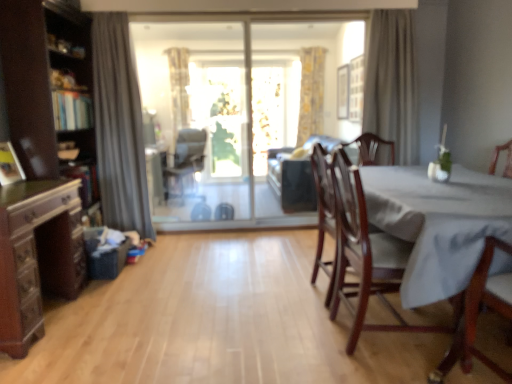
Describe the element at coordinates (37, 256) in the screenshot. The height and width of the screenshot is (384, 512). I see `dark wood dresser at left` at that location.

Where is `gray fabric curtain at left, acting as the third curtain starting from the right`? The width and height of the screenshot is (512, 384). gray fabric curtain at left, acting as the third curtain starting from the right is located at coordinates (119, 126).

Describe the element at coordinates (119, 126) in the screenshot. Image resolution: width=512 pixels, height=384 pixels. I see `gray fabric curtain at left, which is the 1th curtain in front-to-back order` at that location.

Describe the element at coordinates (324, 212) in the screenshot. I see `mahogany wood chair at right, positioned as the second chair in back-to-front order` at that location.

This screenshot has width=512, height=384. I want to click on brown wood cabinet at left, so click(39, 76).

The height and width of the screenshot is (384, 512). Describe the element at coordinates (232, 113) in the screenshot. I see `transparent glass sliding door at center, marked as the first window screen in a front-to-back arrangement` at that location.

Measure the distance between matte black chair at center, which is the first chair in left-to-right order, and camera.

The distance of matte black chair at center, which is the first chair in left-to-right order, from camera is 5.24 meters.

You are a GUI agent. You are given a task and a screenshot of the screen. Output one action in this format:
    pyautogui.click(x=<x>, y=<y>)
    Task: Click on the transparent glass screen door at center
    
    Given the screenshot: What is the action you would take?
    pyautogui.click(x=197, y=119)

Where is `dark wood dresser at left`? dark wood dresser at left is located at coordinates (37, 256).

From the image's perspective, relative to suede-like brown couch at center, is mahogany wood chair at right, which is the first chair from right to left, above or below?

mahogany wood chair at right, which is the first chair from right to left, is below suede-like brown couch at center.

Looking at this image, is mahogany wood chair at right, which is counted as the third chair, starting from the back, inside or outside of suede-like brown couch at center?

mahogany wood chair at right, which is counted as the third chair, starting from the back, cannot be found inside suede-like brown couch at center.

Is mahogany wood chair at right, marked as the 1th chair in a front-to-back arrangement, placed right next to suede-like brown couch at center?

No, mahogany wood chair at right, marked as the 1th chair in a front-to-back arrangement, is not touching suede-like brown couch at center.

Which object is more forward, mahogany wood chair at right, the 3th chair in the left-to-right sequence, or suede-like brown couch at center?

mahogany wood chair at right, the 3th chair in the left-to-right sequence.

Considering the relative sizes of matte black chair at center, which is the third chair from front to back, and transparent glass screen door at center in the image provided, is matte black chair at center, which is the third chair from front to back, taller than transparent glass screen door at center?

Incorrect, the height of matte black chair at center, which is the third chair from front to back, is not larger of that of transparent glass screen door at center.

Is matte black chair at center, which is the third chair from front to back, looking in the opposite direction of transparent glass screen door at center?

No, matte black chair at center, which is the third chair from front to back, is not facing the opposite direction of transparent glass screen door at center.

Identify the location of chair located behind the transparent glass screen door at center. This screenshot has height=384, width=512. pyautogui.click(x=185, y=159).

From a real-world perspective, which object rests below the other?

matte black chair at center, which is the third chair from front to back, is physically lower.

Could you tell me if gray fabric curtain at left, which is the first curtain in left-to-right order, is turned towards dark wood dresser at left?

Yes, gray fabric curtain at left, which is the first curtain in left-to-right order, is turned towards dark wood dresser at left.

Is gray fabric curtain at left, which is the 1th curtain in front-to-back order, directly adjacent to dark wood dresser at left?

No, gray fabric curtain at left, which is the 1th curtain in front-to-back order, is not beside dark wood dresser at left.

This screenshot has width=512, height=384. Identify the location of curtain that is the 1st object located behind the dark wood dresser at left. (119, 126).

Which of these two, gray fabric curtain at left, acting as the third curtain starting from the right, or dark wood dresser at left, is bigger?

dark wood dresser at left.

Can you confirm if mahogany wood chair at right, which is the first chair from right to left, is shorter than yellow floral fabric curtain at upper center, the 1th curtain in the back-to-front sequence?

Yes, mahogany wood chair at right, which is the first chair from right to left, is shorter than yellow floral fabric curtain at upper center, the 1th curtain in the back-to-front sequence.

From a real-world perspective, which object stands above the other?

yellow floral fabric curtain at upper center, the 1th curtain in the back-to-front sequence, from a real-world perspective.

Is mahogany wood chair at right, which is the first chair from right to left, positioned far away from yellow floral fabric curtain at upper center, the 1th curtain in the back-to-front sequence?

Yes, mahogany wood chair at right, which is the first chair from right to left, is far from yellow floral fabric curtain at upper center, the 1th curtain in the back-to-front sequence.

From the image's perspective, which one is positioned higher, dark wood dresser at left or gray fabric curtain at left, which is the 3th curtain in back-to-front order?

gray fabric curtain at left, which is the 3th curtain in back-to-front order.

Is dark wood dresser at left not within gray fabric curtain at left, which is the 1th curtain in front-to-back order?

Yes, dark wood dresser at left is located beyond the bounds of gray fabric curtain at left, which is the 1th curtain in front-to-back order.

In the scene shown: Is dark wood dresser at left smaller than gray fabric curtain at left, acting as the third curtain starting from the right?

Actually, dark wood dresser at left might be larger than gray fabric curtain at left, acting as the third curtain starting from the right.

In terms of size, does brown wood cabinet at left appear bigger or smaller than suede-like brown couch at center?

In the image, brown wood cabinet at left appears to be smaller than suede-like brown couch at center.

Which of these two, brown wood cabinet at left or suede-like brown couch at center, stands shorter?

With less height is suede-like brown couch at center.

Considering the positions of point (13, 102) and point (310, 177), is point (13, 102) closer or farther from the camera than point (310, 177)?

Point (13, 102) is closer to the camera than point (310, 177).

Does point (13, 321) appear closer or farther from the camera than point (80, 159)?

Point (13, 321).

Considering the relative sizes of dark wood dresser at left and brown wood cabinet at left in the image provided, is dark wood dresser at left wider than brown wood cabinet at left?

Yes, dark wood dresser at left is wider than brown wood cabinet at left.

From the image's perspective, which one is positioned higher, dark wood dresser at left or brown wood cabinet at left?

From the image's view, brown wood cabinet at left is above.

Between dark wood dresser at left and brown wood cabinet at left, which one has smaller size?

With smaller size is dark wood dresser at left.

From the image's perspective, starting from the suede-like brown couch at center, which chair is the 2nd one below? Please provide its 2D coordinates.

[(365, 255)]

Locate an element on the screen. The height and width of the screenshot is (384, 512). screen door on the right of the matte black chair at center, which is the first chair in left-to-right order is located at coordinates (197, 119).

When comparing their distances from gray fabric curtain at left, which is the 1th curtain in front-to-back order, does transparent glass sliding door at center, marked as the first window screen in a front-to-back arrangement, or beige fabric curtain at upper right, the 2th curtain viewed from the front, seem closer?

transparent glass sliding door at center, marked as the first window screen in a front-to-back arrangement, is closer to gray fabric curtain at left, which is the 1th curtain in front-to-back order.

Based on their spatial positions, is dark wood dresser at left or suede-like brown couch at center closer to gray fabric curtain at left, acting as the third curtain starting from the right?

dark wood dresser at left is closer to gray fabric curtain at left, acting as the third curtain starting from the right.

In the scene shown: Looking at the image, which one is located closer to dark wood dresser at left, beige fabric curtain at upper right, acting as the 2th curtain starting from the back, or mahogany wood chair at right, marked as the 1th chair in a front-to-back arrangement?

mahogany wood chair at right, marked as the 1th chair in a front-to-back arrangement, lies closer to dark wood dresser at left than the other object.

Which object lies nearer to the anchor point suede-like brown couch at center, mahogany wood chair at right, which is the first chair from right to left, or beige fabric curtain at upper right, the 2th curtain viewed from the front?

beige fabric curtain at upper right, the 2th curtain viewed from the front, is closer to suede-like brown couch at center.

Which object lies further to the anchor point yellow floral fabric curtain at upper center, the second curtain positioned from the right, mahogany wood chair at right, which is counted as the third chair, starting from the back, or mahogany wood chair at right, marked as the 2th chair in a front-to-back arrangement?

Based on the image, mahogany wood chair at right, which is counted as the third chair, starting from the back, appears to be further to yellow floral fabric curtain at upper center, the second curtain positioned from the right.

Considering their positions, is transparent glass sliding door at center, marked as the first window screen in a front-to-back arrangement, positioned closer to suede-like brown couch at center than beige fabric curtain at upper right, the 2th curtain viewed from the front?

transparent glass sliding door at center, marked as the first window screen in a front-to-back arrangement.

When comparing their distances from matte black chair at center, which is the third chair from front to back, does transparent glass sliding door at center, arranged as the 2th window screen when viewed from the back, or dark wood dresser at left seem closer?

transparent glass sliding door at center, arranged as the 2th window screen when viewed from the back, is positioned closer to the anchor matte black chair at center, which is the third chair from front to back.

Looking at the image, which one is located closer to transparent glass sliding door at center, marked as the first window screen in a front-to-back arrangement, matte black chair at center, which is the third chair from front to back, or yellow floral fabric curtain at upper center, which is the 2th curtain from left to right?

matte black chair at center, which is the third chair from front to back.

The height and width of the screenshot is (384, 512). What are the coordinates of `screen door located between brown wood cabinet at left and suede-like brown couch at center in the left-right direction` in the screenshot? It's located at (197, 119).

Where is `window screen between beige fabric curtain at upper right, acting as the 2th curtain starting from the back, and suede-like brown couch at center in the front-back direction`? window screen between beige fabric curtain at upper right, acting as the 2th curtain starting from the back, and suede-like brown couch at center in the front-back direction is located at coordinates (232, 113).

Locate an element on the screen. The width and height of the screenshot is (512, 384). screen door located between mahogany wood chair at right, marked as the 1th chair in a front-to-back arrangement, and suede-like brown couch at center in the depth direction is located at coordinates (197, 119).

This screenshot has width=512, height=384. I want to click on dresser positioned between mahogany wood chair at right, which is the first chair from right to left, and transparent glass screen door at center from near to far, so click(x=37, y=256).